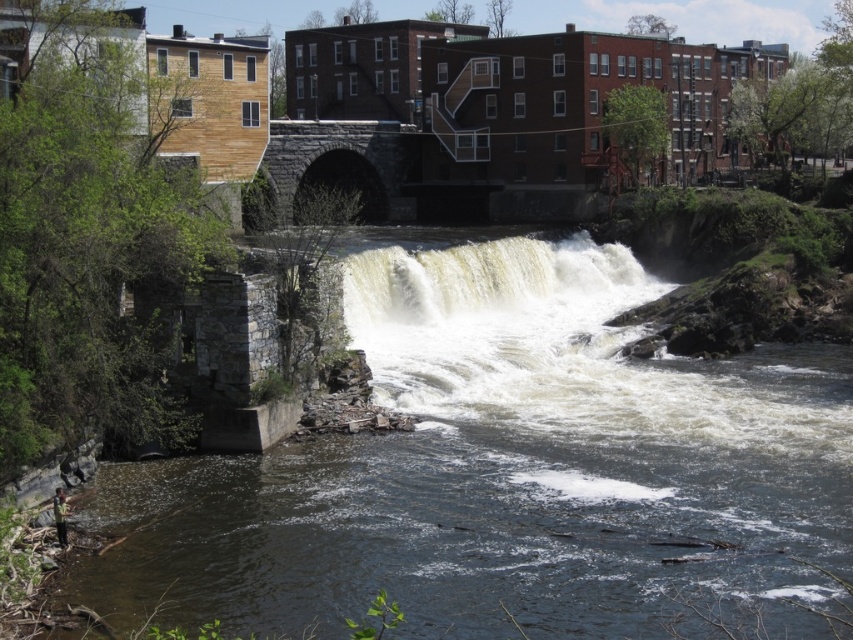
Question: Is the position of dark gray concrete river at lower left more distant than that of white frothy water at center?

Choices:
 (A) yes
 (B) no

Answer: (B)

Question: Which object appears farthest from the camera in this image?

Choices:
 (A) dark gray concrete river at lower left
 (B) white frothy water at center

Answer: (B)

Question: Which of the following is the closest to the observer?

Choices:
 (A) dark gray concrete river at lower left
 (B) white frothy water at center

Answer: (A)

Question: Can you confirm if dark gray concrete river at lower left is wider than white frothy water at center?

Choices:
 (A) no
 (B) yes

Answer: (B)

Question: Does dark gray concrete river at lower left appear over white frothy water at center?

Choices:
 (A) yes
 (B) no

Answer: (B)